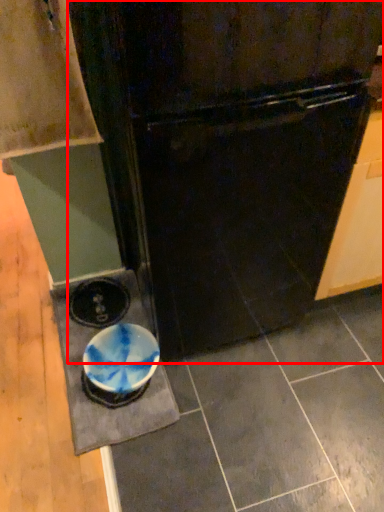
Question: Observing the image, what is the correct spatial positioning of refrigerator (annotated by the red box) in reference to cabinetry?

Choices:
 (A) left
 (B) right

Answer: (B)